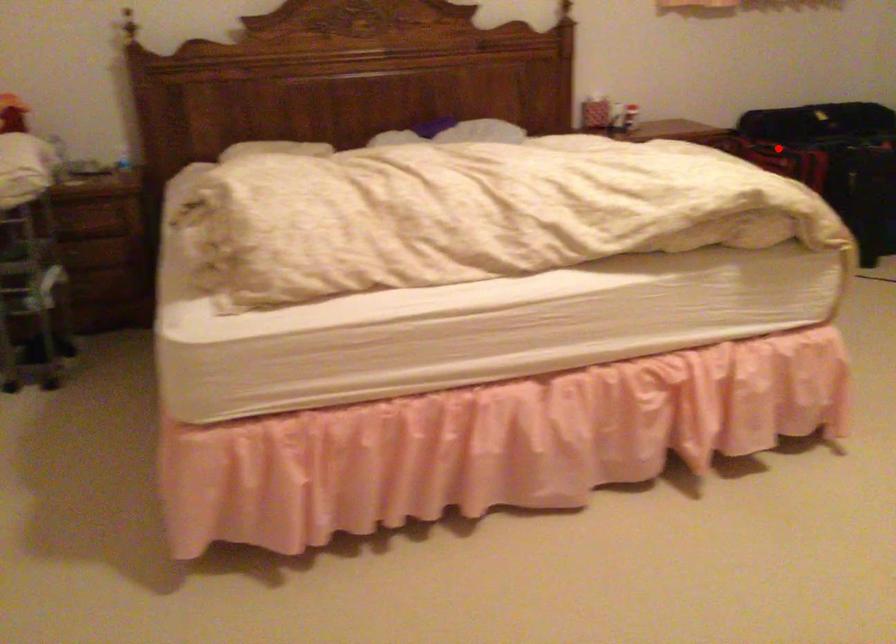
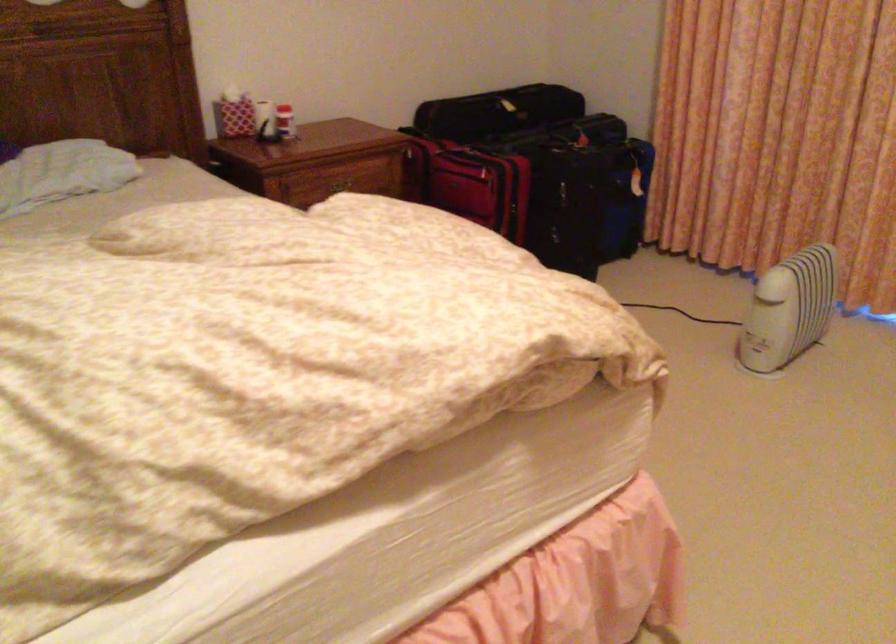
Question: I am providing you with two images of the same scene from different viewpoints. Given a red point in image1, look at the same physical point in image2. Is it:

Choices:
 (A) Closer to the viewpoint
 (B) Farther from the viewpoint

Answer: (A)